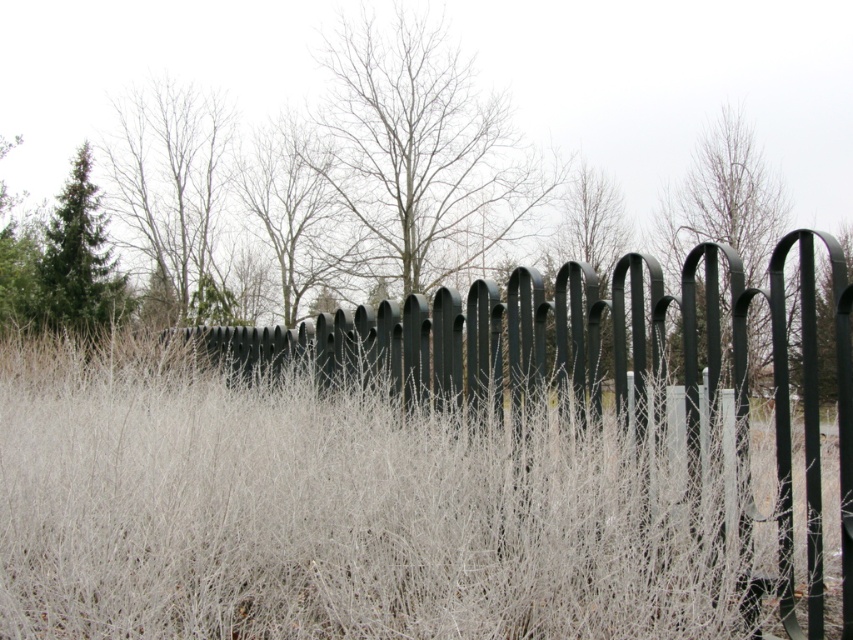
Question: Is smooth bark tree at upper left to the left of green matte tree at upper right from the viewer's perspective?

Choices:
 (A) yes
 (B) no

Answer: (A)

Question: Can you confirm if white frosted grass at center is positioned to the right of green matte tree at upper right?

Choices:
 (A) yes
 (B) no

Answer: (B)

Question: Is white frosted grass at center further to the viewer compared to green matte tree at upper right?

Choices:
 (A) yes
 (B) no

Answer: (B)

Question: Among these objects, which one is nearest to the camera?

Choices:
 (A) green matte tree at upper right
 (B) green matte evergreen tree at upper left
 (C) white frosted grass at center
 (D) smooth bark tree at upper left

Answer: (C)

Question: Among these points, which one is nearest to the camera?

Choices:
 (A) (55, 266)
 (B) (747, 156)
 (C) (137, 186)

Answer: (A)

Question: Which point is closer to the camera taking this photo?

Choices:
 (A) (78, 310)
 (B) (693, 552)
 (C) (666, 273)
 (D) (225, 292)

Answer: (B)